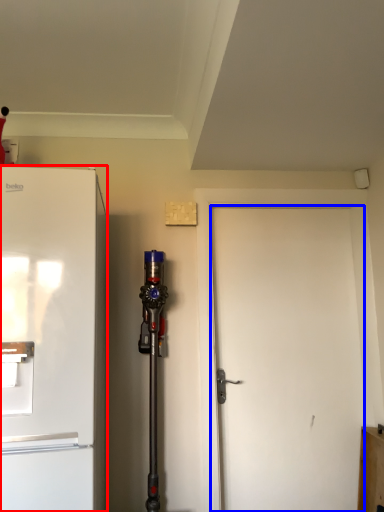
Question: Among these objects, which one is nearest to the camera, refrigerator (highlighted by a red box) or door (highlighted by a blue box)?

Choices:
 (A) refrigerator
 (B) door

Answer: (A)